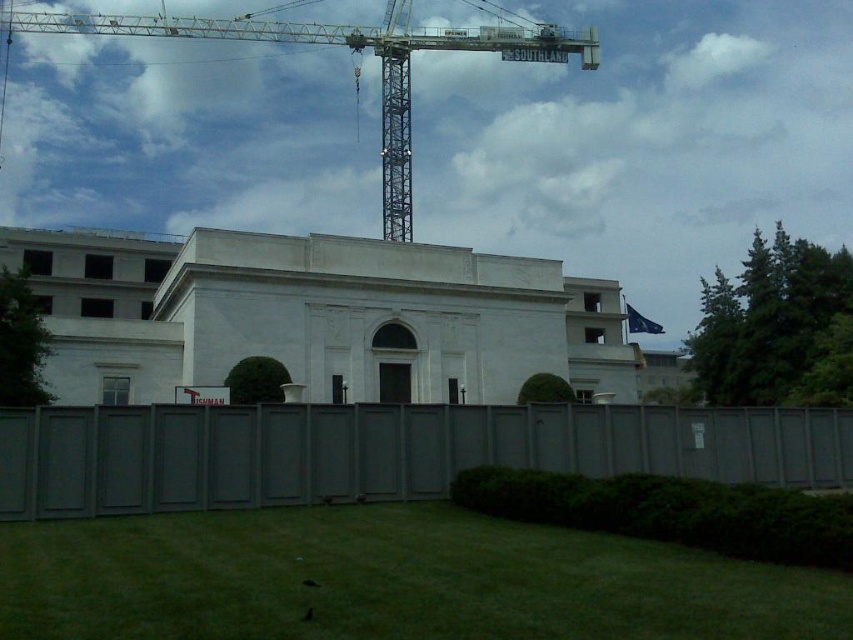
Who is positioned more to the right, gray wood fence at lower center or metallic gray crane at upper center?

gray wood fence at lower center

Who is more forward, (648, 420) or (45, 13)?

Point (648, 420)

At what (x,y) coordinates should I click in order to perform the action: click on gray wood fence at lower center. Please return your answer as a coordinate pair (x, y). Looking at the image, I should click on (384, 451).